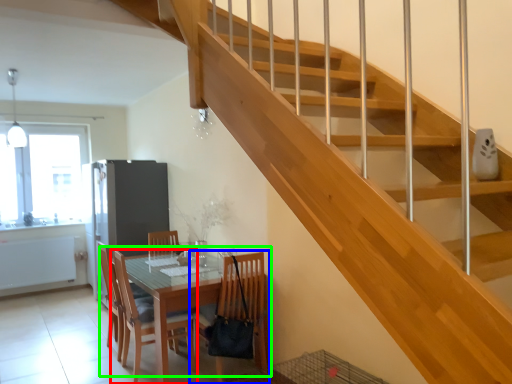
Question: Which is farther away from chair (highlighted by a red box)? chair (highlighted by a blue box) or kitchen & dining room table (highlighted by a green box)?

Choices:
 (A) chair
 (B) kitchen & dining room table

Answer: (A)